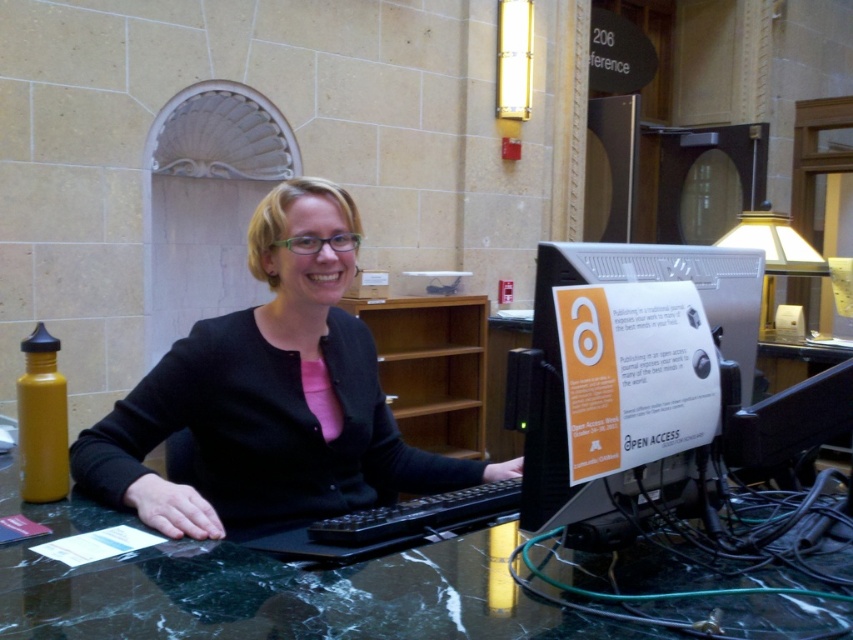
You are standing in front of the desk and want to place a small gift on the black matte sweater at center. Where exactly on the desk should you place it?

You should place the small gift at point coordinates of (270, 397), where the black matte sweater at center is located.

You are organizing a desk and need to place a new item between the black matte sweater at center and the silver metallic computer monitor at center. Which object should you place the item closer to if the item requires more space on the desk?

The item should be placed closer to the black matte sweater at center because it is wider than the silver metallic computer monitor at center, providing more space.

You are trying to set up a new lamp on the desk. The lamp requires a surface that is not directly under the silver metallic computer monitor at center. Can you place the lamp on the marble table at center?

The marble table at center is positioned under the silver metallic computer monitor at center, so placing the lamp there would mean it is under the monitor. Therefore, you cannot place the lamp on the marble table at center as it is directly under the monitor.